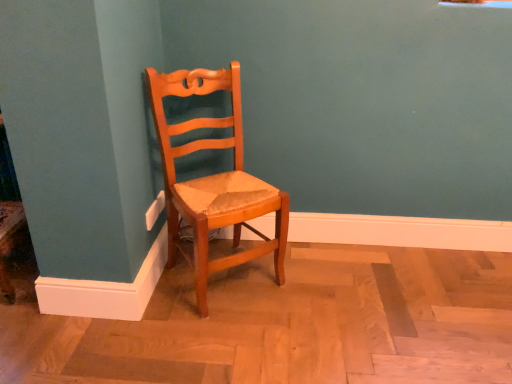
Where is `wooden chair at center`? wooden chair at center is located at coordinates (213, 179).

What do you see at coordinates (213, 179) in the screenshot?
I see `wooden chair at center` at bounding box center [213, 179].

Identify the location of wooden chair at center. The width and height of the screenshot is (512, 384). (213, 179).